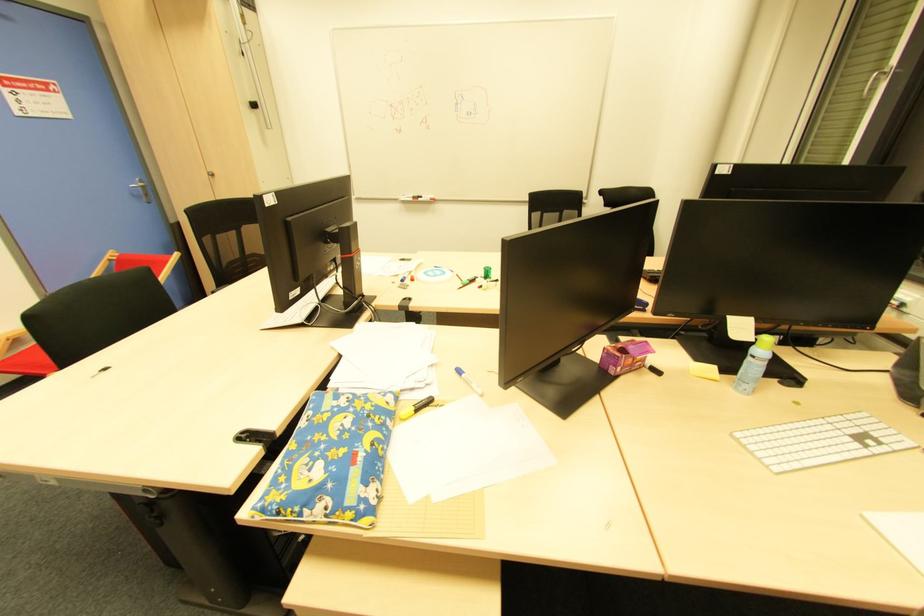
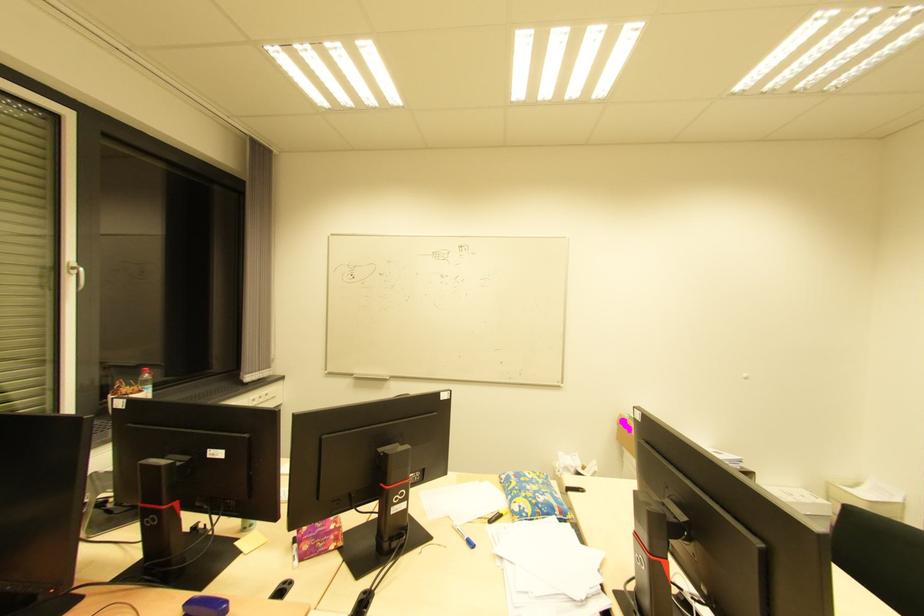
Where in the second image is the point corresponding to (x=377, y=408) from the first image?

(518, 498)